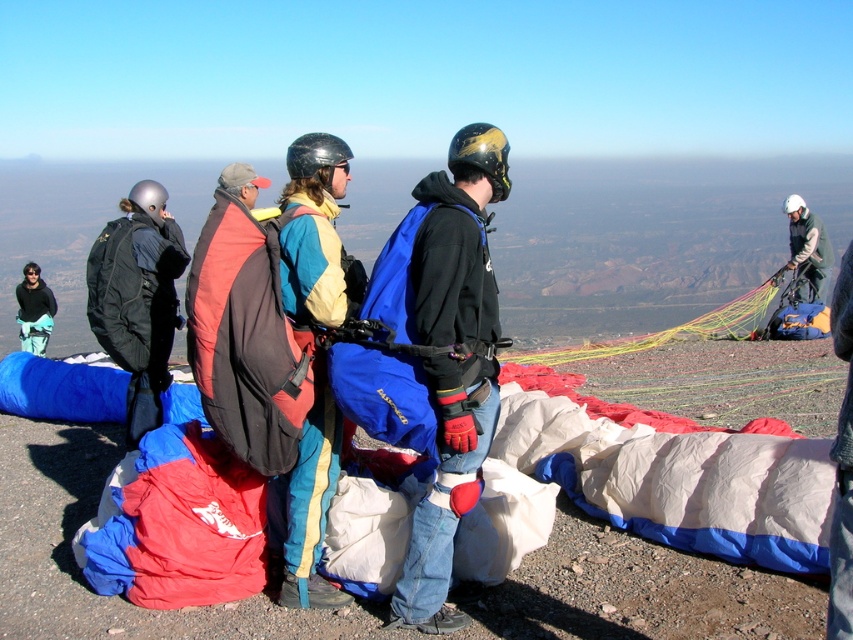
Question: Is matte black backpack at left to the right of brushed metal helmet at upper left from the viewer's perspective?

Choices:
 (A) no
 (B) yes

Answer: (B)

Question: Among these points, which one is nearest to the camera?

Choices:
 (A) (157, 304)
 (B) (465, 348)
 (C) (790, 240)
 (D) (308, 600)

Answer: (B)

Question: Estimate the real-world distances between objects in this image. Which object is farther from the matte blue and yellow jacket at center?

Choices:
 (A) blue fabric parachute at center
 (B) green fabric parachute at upper right
 (C) brushed metal helmet at upper left
 (D) matte black backpack at left

Answer: (C)

Question: Where is blue fabric parachute at center located in relation to matte blue and yellow jacket at center in the image?

Choices:
 (A) left
 (B) right

Answer: (B)

Question: Is blue fabric parachute at center below green fabric parachute at upper right?

Choices:
 (A) yes
 (B) no

Answer: (A)

Question: Which point is closer to the camera?

Choices:
 (A) matte black backpack at left
 (B) blue fabric parachute at center

Answer: (B)